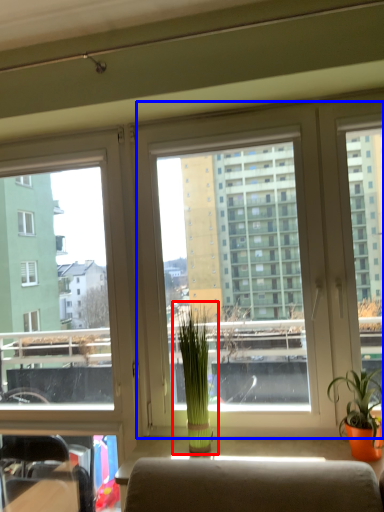
Question: Which point is further to the camera, houseplant (highlighted by a red box) or window screen (highlighted by a blue box)?

Choices:
 (A) houseplant
 (B) window screen

Answer: (A)